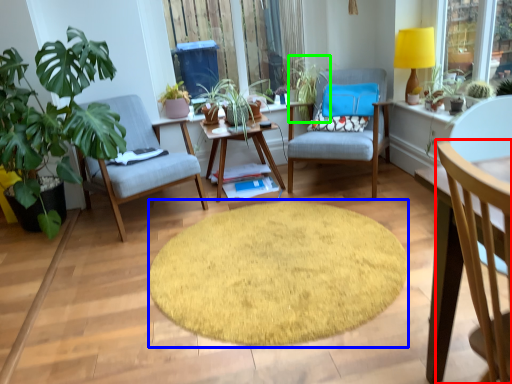
Question: Which object is positioned farthest from chair (highlighted by a red box)? Select from mat (highlighted by a blue box) and vegetation (highlighted by a green box).

Choices:
 (A) mat
 (B) vegetation

Answer: (B)